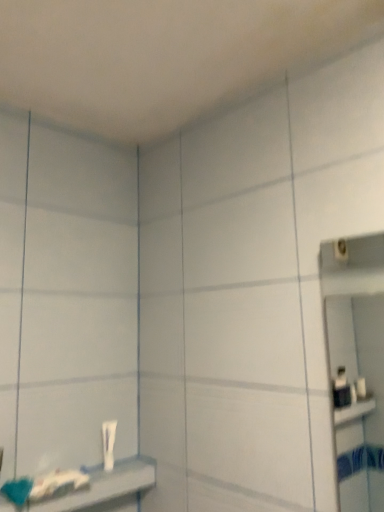
Question: Does point (110, 421) appear closer or farther from the camera than point (147, 473)?

Choices:
 (A) closer
 (B) farther

Answer: (B)

Question: Would you say white glossy tube at lower left is inside or outside white glossy shelf at lower left?

Choices:
 (A) outside
 (B) inside

Answer: (A)

Question: From the image's perspective, is white glossy tube at lower left positioned above or below white glossy shelf at lower left?

Choices:
 (A) above
 (B) below

Answer: (A)

Question: Does point (49, 502) appear closer or farther from the camera than point (109, 450)?

Choices:
 (A) closer
 (B) farther

Answer: (A)

Question: From the image's perspective, is white glossy shelf at lower left positioned above or below white glossy tube at lower left?

Choices:
 (A) above
 (B) below

Answer: (B)

Question: Do you think white glossy shelf at lower left is within white glossy tube at lower left, or outside of it?

Choices:
 (A) outside
 (B) inside

Answer: (A)

Question: Looking at their shapes, would you say white glossy shelf at lower left is wider or thinner than white glossy tube at lower left?

Choices:
 (A) wide
 (B) thin

Answer: (A)